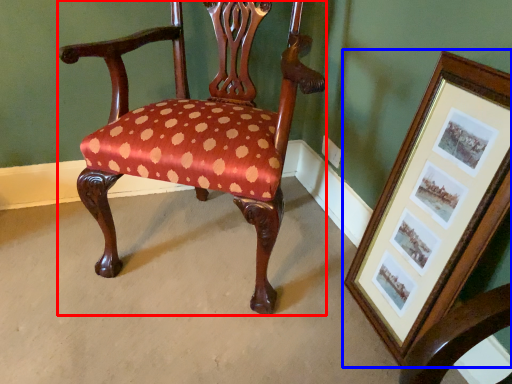
Question: Which of the following is the farthest to the observer, chair (highlighted by a red box) or picture frame (highlighted by a blue box)?

Choices:
 (A) chair
 (B) picture frame

Answer: (A)